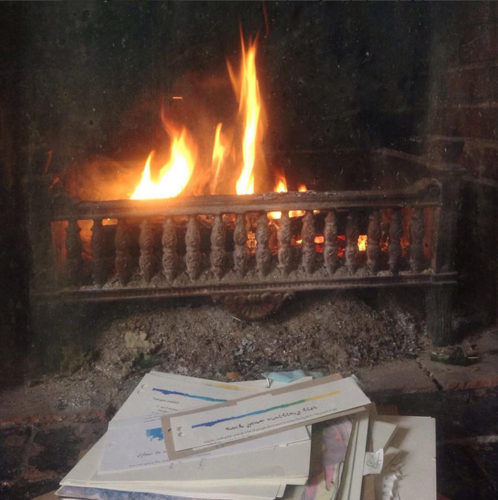
Identify the location of folder. (267, 467), (267, 490), (356, 487), (372, 492).